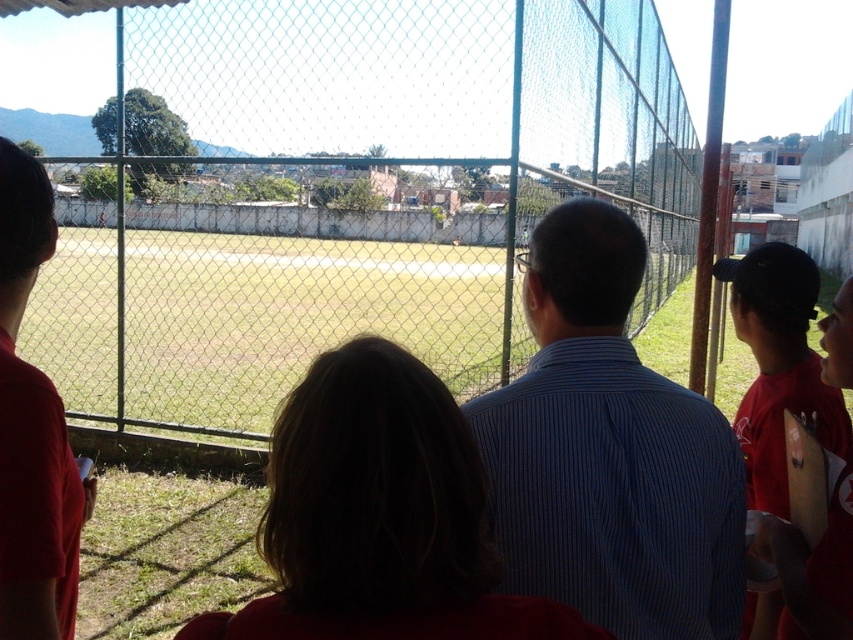
You are a photographer trying to capture a wide shot of the metal mesh fence at center and the red cotton shirt at right. Considering their sizes, which object should you focus on first to ensure both are in frame without moving the camera?

The metal mesh fence at center should be focused on first because its width is larger than the red cotton shirt at right, so positioning it properly ensures there is enough space for both in the frame.

You are standing in front of the fence and want to take a photo of both the point at coordinates (352, 44) and the point at coordinates (705, 403). Which point should you focus on first to ensure both are in focus?

You should focus on the point at coordinates (352, 44) first because it is closer to you than the point at coordinates (705, 403). This way, both points will be within the camera focus range.

You are a photographer trying to capture a photo of the baseball field. You notice two points marked in the image at coordinates point (344,221) and point (822,426). Which point should you focus on to ensure the foreground is sharp while keeping the background slightly blurred?

You should focus on point (344,221) because it is closer to the camera compared to point (822,426). This allows the foreground elements to be sharp while the background becomes blurred.